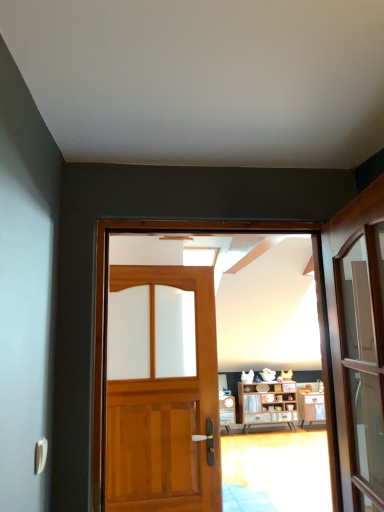
Question: In terms of height, does wooden door at center, the first door in the front-to-back sequence, look taller or shorter compared to white glossy door handle at lower left?

Choices:
 (A) tall
 (B) short

Answer: (A)

Question: From the image's perspective, relative to white glossy door handle at lower left, is wooden door at center, the first door in the front-to-back sequence, above or below?

Choices:
 (A) below
 (B) above

Answer: (B)

Question: Estimate the real-world distances between objects in this image. Which object is closer to the wooden cabinet at center?

Choices:
 (A) wooden door at center, the first door in the front-to-back sequence
 (B) wooden door at center, which is counted as the 1th door, starting from the back
 (C) white glossy door handle at lower left

Answer: (A)

Question: Considering the real-world distances, which object is farthest from the wooden door at center, the first door in the front-to-back sequence?

Choices:
 (A) wooden cabinet at center
 (B) white glossy door handle at lower left
 (C) wooden door at center, which is the second door from front to back

Answer: (B)